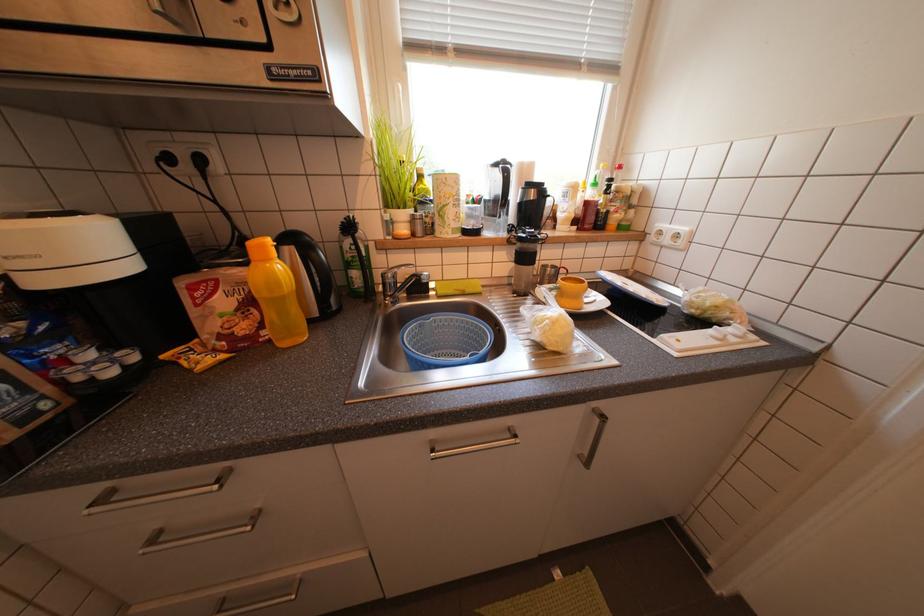
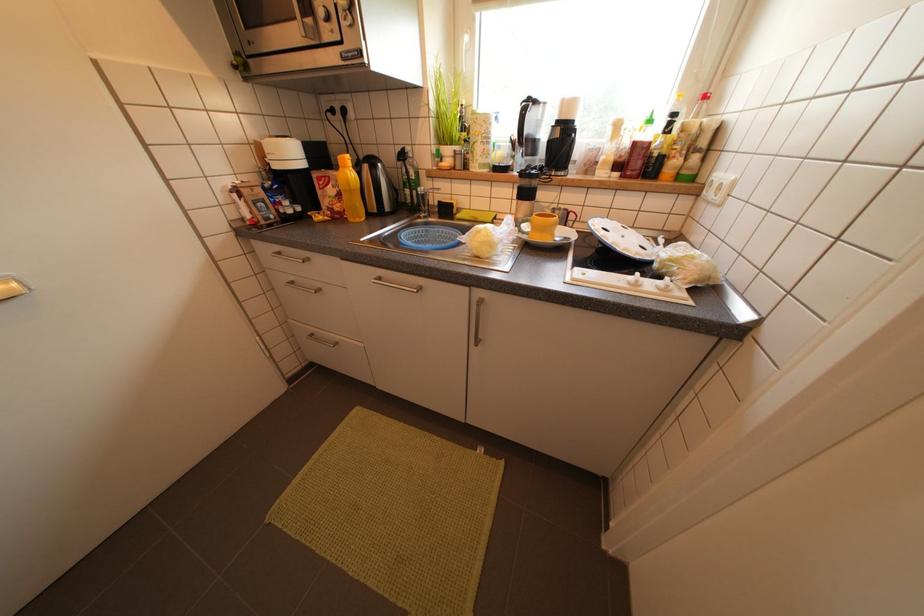
Question: The camera is either moving clockwise (left) or counter-clockwise (right) around the object. The first image is from the beginning of the video and the second image is from the end. Is the camera moving left or right when shooting the video?

Choices:
 (A) Left
 (B) Right

Answer: (B)